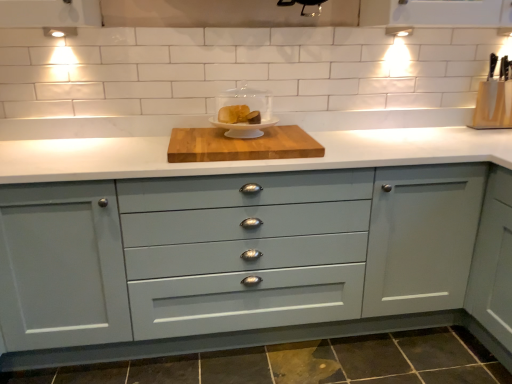
Question: From the image's perspective, does wooden knife block at upper right, positioned as the 2th appliance in left-to-right order, appear higher than matte gray cabinet at center?

Choices:
 (A) no
 (B) yes

Answer: (B)

Question: Is wooden knife block at upper right, the 1th appliance from the right, positioned in front of matte gray cabinet at center?

Choices:
 (A) yes
 (B) no

Answer: (B)

Question: Does wooden knife block at upper right, positioned as the 2th appliance in left-to-right order, appear on the left side of matte gray cabinet at center?

Choices:
 (A) yes
 (B) no

Answer: (B)

Question: Is matte gray cabinet at center at the back of wooden knife block at upper right, the 1th appliance from the right?

Choices:
 (A) yes
 (B) no

Answer: (B)

Question: From a real-world perspective, does wooden knife block at upper right, which is counted as the second appliance, starting from the front, sit lower than matte gray cabinet at center?

Choices:
 (A) no
 (B) yes

Answer: (A)

Question: From a real-world perspective, does wooden knife block at upper right, positioned as the 2th appliance in left-to-right order, stand above matte gray cabinet at center?

Choices:
 (A) yes
 (B) no

Answer: (A)

Question: Is matte gray cabinet at center in contact with matte white cake stand at center, which appears as the 1th appliance when viewed from the left?

Choices:
 (A) no
 (B) yes

Answer: (A)

Question: Does matte gray cabinet at center lie behind matte white cake stand at center, the 2th appliance from the back?

Choices:
 (A) no
 (B) yes

Answer: (A)

Question: Is matte gray cabinet at center to the left of matte white cake stand at center, the 2th appliance from the back, from the viewer's perspective?

Choices:
 (A) no
 (B) yes

Answer: (B)

Question: Can you confirm if matte gray cabinet at center is positioned to the right of matte white cake stand at center, which appears as the first appliance when viewed from the front?

Choices:
 (A) yes
 (B) no

Answer: (B)

Question: Is matte gray cabinet at center located outside matte white cake stand at center, which appears as the 1th appliance when viewed from the left?

Choices:
 (A) yes
 (B) no

Answer: (A)

Question: Could you tell me if matte gray cabinet at center is turned towards matte white cake stand at center, which appears as the 1th appliance when viewed from the left?

Choices:
 (A) no
 (B) yes

Answer: (A)

Question: Is matte white cake stand at center, which appears as the 1th appliance when viewed from the left, to the right of wooden cutting board at center from the viewer's perspective?

Choices:
 (A) yes
 (B) no

Answer: (A)